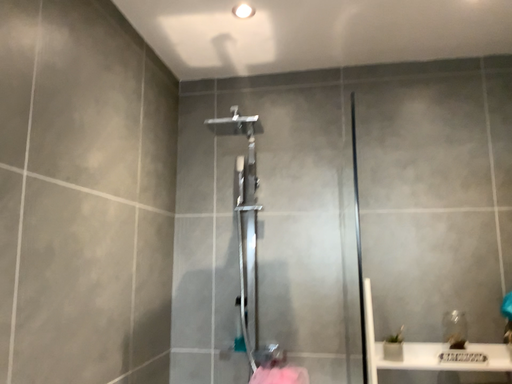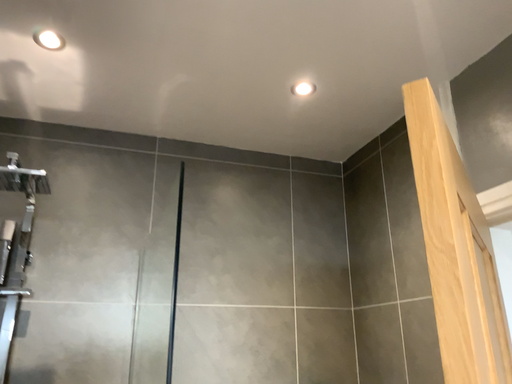
Question: How did the camera likely rotate when shooting the video?

Choices:
 (A) rotated right
 (B) rotated left

Answer: (A)